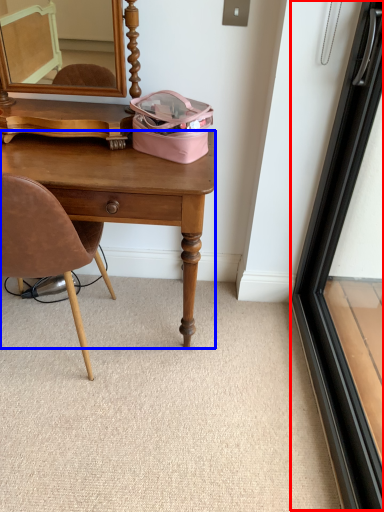
Question: Which of the following is the farthest to the observer, screen door (highlighted by a red box) or desk (highlighted by a blue box)?

Choices:
 (A) screen door
 (B) desk

Answer: (B)